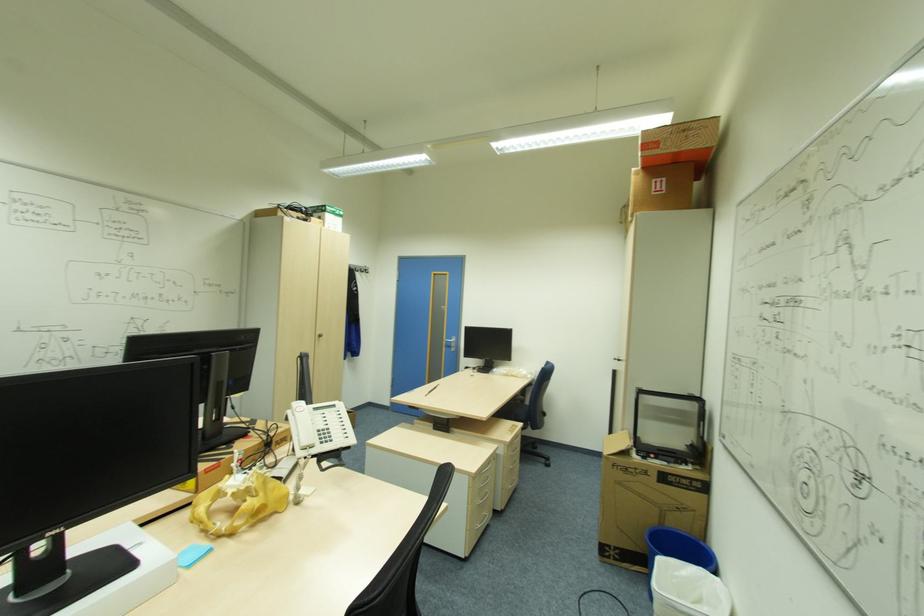
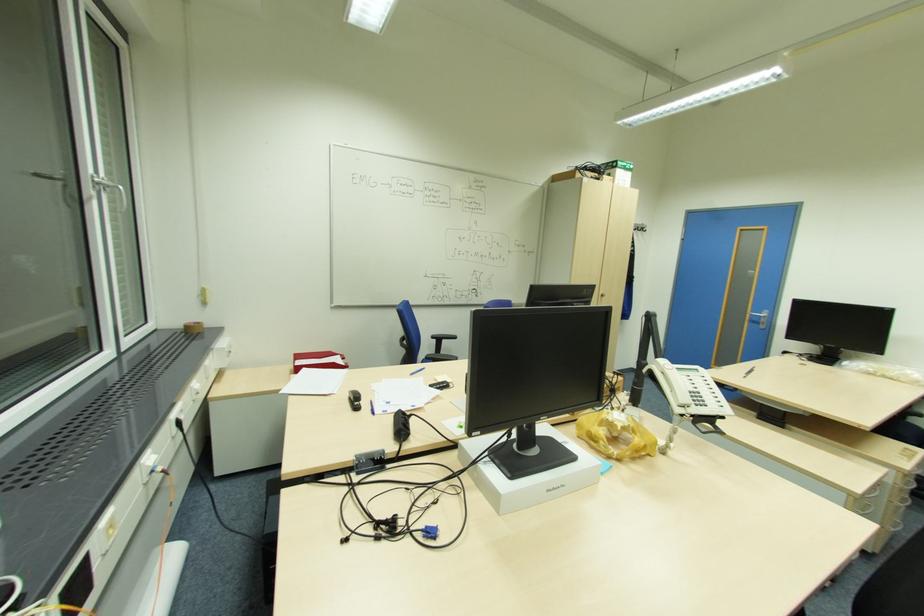
Find the pixel in the second image that matches (x=324, y=442) in the first image.

(699, 403)